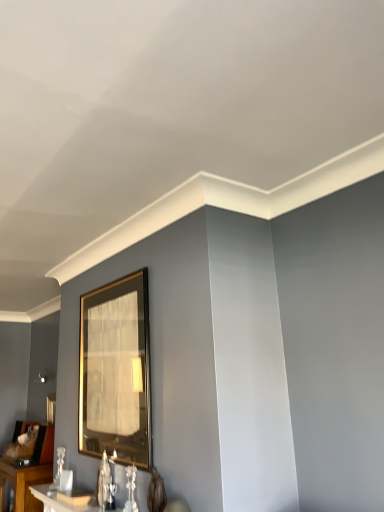
Question: Can you confirm if gold metallic picture frame at center, arranged as the first picture frame when viewed from the front, is smaller than white glossy table at lower left, acting as the second table starting from the right?

Choices:
 (A) no
 (B) yes

Answer: (B)

Question: From a real-world perspective, is gold metallic picture frame at center, which ranks as the first picture frame in top-to-bottom order, physically below white glossy table at lower left, the first table when ordered from back to front?

Choices:
 (A) yes
 (B) no

Answer: (B)

Question: Could you tell me if gold metallic picture frame at center, the second picture frame in the bottom-to-top sequence, is facing white glossy table at lower left, the 1th table ordered from the bottom?

Choices:
 (A) no
 (B) yes

Answer: (A)

Question: Is white glossy table at lower left, the 1th table ordered from the bottom, inside gold metallic picture frame at center, the 2th picture frame when ordered from left to right?

Choices:
 (A) no
 (B) yes

Answer: (A)

Question: From the image's perspective, is gold metallic picture frame at center, the 2th picture frame when ordered from left to right, located above white glossy table at lower left, which is the first table in left-to-right order?

Choices:
 (A) yes
 (B) no

Answer: (A)

Question: Considering the positions of white glossy table at lower left, acting as the second table starting from the front, and white glossy table at lower left, placed as the 2th table when sorted from bottom to top, in the image, is white glossy table at lower left, acting as the second table starting from the front, taller or shorter than white glossy table at lower left, placed as the 2th table when sorted from bottom to top,?

Choices:
 (A) tall
 (B) short

Answer: (A)

Question: Is white glossy table at lower left, the 1th table ordered from the bottom, situated inside white glossy table at lower left, placed as the 2th table when sorted from bottom to top, or outside?

Choices:
 (A) outside
 (B) inside

Answer: (A)

Question: From a real-world perspective, is white glossy table at lower left, which is the first table in left-to-right order, physically located above or below white glossy table at lower left, the 1th table when ordered from right to left?

Choices:
 (A) below
 (B) above

Answer: (A)

Question: Is white glossy table at lower left, the first table when ordered from back to front, to the left or to the right of white glossy table at lower left, the 1th table in the front-to-back sequence, in the image?

Choices:
 (A) right
 (B) left

Answer: (B)

Question: Is gold-framed mirror at lower left, which is the first picture frame from back to front, inside or outside of white glossy table at lower left, the 1th table in the front-to-back sequence?

Choices:
 (A) outside
 (B) inside

Answer: (A)

Question: From the image's perspective, is gold-framed mirror at lower left, which is the second picture frame in top-to-bottom order, positioned above or below white glossy table at lower left, which is the second table from back to front?

Choices:
 (A) above
 (B) below

Answer: (B)

Question: Considering the positions of gold-framed mirror at lower left, which is the second picture frame in top-to-bottom order, and white glossy table at lower left, which is the second table from back to front, in the image, is gold-framed mirror at lower left, which is the second picture frame in top-to-bottom order, wider or thinner than white glossy table at lower left, which is the second table from back to front,?

Choices:
 (A) thin
 (B) wide

Answer: (B)

Question: Is gold-framed mirror at lower left, arranged as the second picture frame when viewed from the right, bigger or smaller than white glossy table at lower left, placed as the 2th table when sorted from bottom to top?

Choices:
 (A) big
 (B) small

Answer: (B)

Question: Considering the positions of point (36, 423) and point (92, 397), is point (36, 423) closer or farther from the camera than point (92, 397)?

Choices:
 (A) farther
 (B) closer

Answer: (A)

Question: Looking at their shapes, would you say gold-framed mirror at lower left, marked as the first picture frame in a left-to-right arrangement, is wider or thinner than gold metallic picture frame at center, the second picture frame in the bottom-to-top sequence?

Choices:
 (A) thin
 (B) wide

Answer: (B)